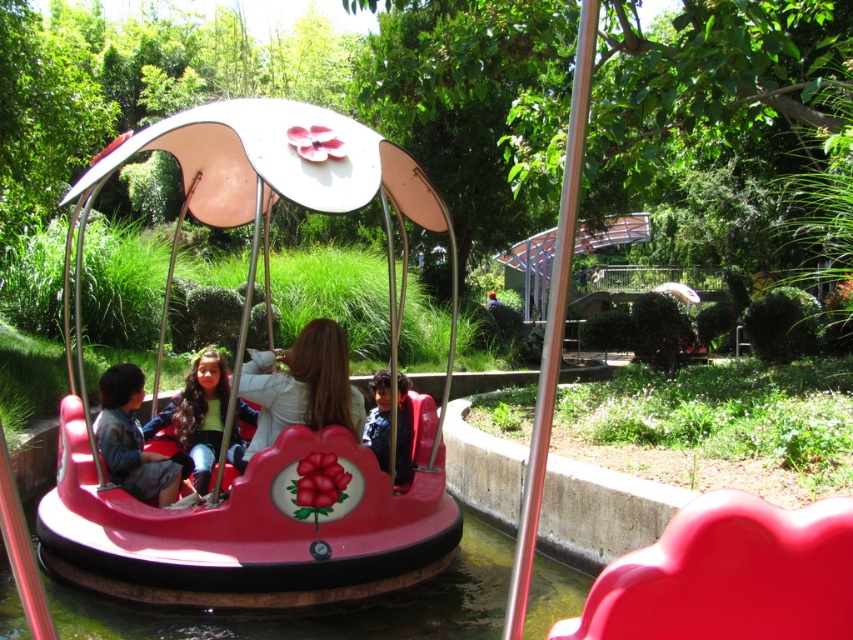
Question: Is shiny plastic bumper car at center below denim jacket at left?

Choices:
 (A) no
 (B) yes

Answer: (B)

Question: Which point appears closest to the camera in this image?

Choices:
 (A) (166, 416)
 (B) (367, 435)
 (C) (126, 412)

Answer: (C)

Question: Is denim jacket at left closer to the viewer compared to dark blue denim jacket at center?

Choices:
 (A) no
 (B) yes

Answer: (B)

Question: Which point is closer to the camera?

Choices:
 (A) matte white jacket at center
 (B) shiny plastic bumper car at center
 (C) matte pink hair at center
 (D) denim jacket at left

Answer: (B)

Question: Based on their relative distances, which object is nearer to the denim jacket at left?

Choices:
 (A) matte pink hair at center
 (B) matte white jacket at center
 (C) shiny plastic bumper car at center

Answer: (A)

Question: Is shiny plastic bumper car at center bigger than denim jacket at left?

Choices:
 (A) yes
 (B) no

Answer: (A)